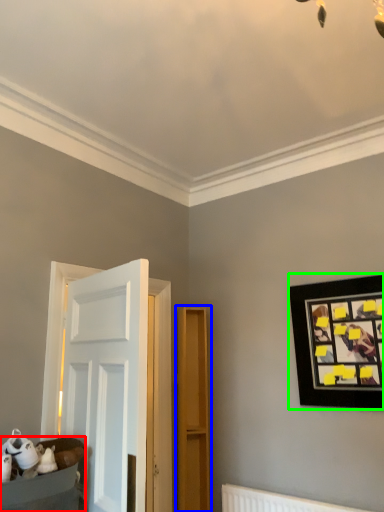
Question: Based on their relative distances, which object is farther from furniture (highlighted by a red box)? Choose from dresser (highlighted by a blue box) and picture frame (highlighted by a green box).

Choices:
 (A) dresser
 (B) picture frame

Answer: (B)